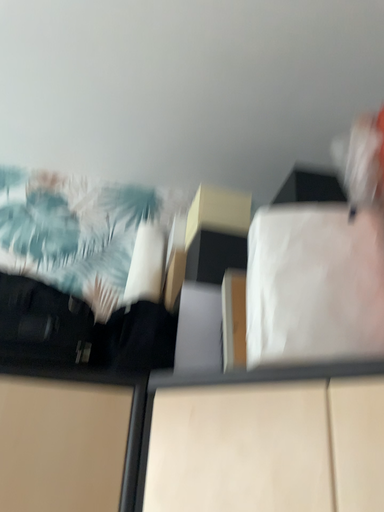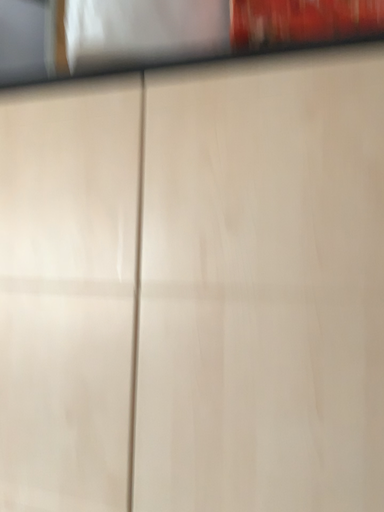
Question: Which way did the camera rotate in the video?

Choices:
 (A) rotated left
 (B) rotated right

Answer: (B)